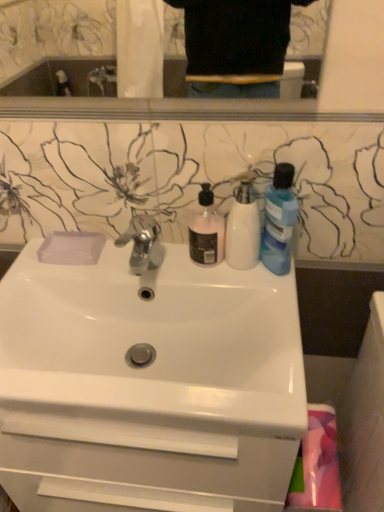
At what (x,y) coordinates should I click in order to perform the action: click on vacant area situated to the left side of polished chrome faucet at center. Please return your answer as a coordinate pair (x, y). The image size is (384, 512). Looking at the image, I should click on (75, 263).